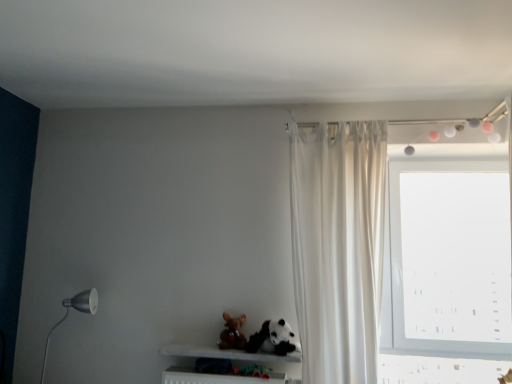
What is the approximate width of matte black lamp at left?

6.43 inches.

What is the approximate height of transparent glass window at upper right?

transparent glass window at upper right is 4.97 feet tall.

This screenshot has width=512, height=384. Describe the element at coordinates (447, 259) in the screenshot. I see `transparent glass window at upper right` at that location.

Measure the distance between black plush panda at lower center and camera.

The depth of black plush panda at lower center is 7.86 feet.

Describe the element at coordinates (232, 333) in the screenshot. I see `velvety brown teddy bear at lower center` at that location.

Where is `velvety brown teddy bear at lower center`? velvety brown teddy bear at lower center is located at coordinates (232, 333).

What do you see at coordinates (338, 247) in the screenshot?
I see `white silky curtain at right` at bounding box center [338, 247].

The image size is (512, 384). I want to click on white silky curtain at right, so click(x=338, y=247).

Locate an element on the screen. The height and width of the screenshot is (384, 512). matte black lamp at left is located at coordinates (68, 313).

Would you say white marble shelf at lower center is a long distance from white silky curtain at right?

That's not correct — white marble shelf at lower center is a little close to white silky curtain at right.

The width and height of the screenshot is (512, 384). I want to click on shelf that appears below the white silky curtain at right (from the image's perspective), so click(226, 353).

Can you tell me how much white marble shelf at lower center and white silky curtain at right differ in facing direction?

The angle between the facing direction of white marble shelf at lower center and the facing direction of white silky curtain at right is 4.26 degrees.

Which object is thinner, white marble shelf at lower center or white silky curtain at right?

With smaller width is white marble shelf at lower center.

Considering the sizes of white silky curtain at right and velvety brown teddy bear at lower center in the image, is white silky curtain at right wider or thinner than velvety brown teddy bear at lower center?

In the image, white silky curtain at right appears to be wider than velvety brown teddy bear at lower center.

From a real-world perspective, is white silky curtain at right positioned over velvety brown teddy bear at lower center based on gravity?

Indeed, from a real-world perspective, white silky curtain at right stands above velvety brown teddy bear at lower center.

Which of these two, white silky curtain at right or velvety brown teddy bear at lower center, stands shorter?

velvety brown teddy bear at lower center.

Is white silky curtain at right smaller than velvety brown teddy bear at lower center?

Actually, white silky curtain at right might be larger than velvety brown teddy bear at lower center.

Does white marble shelf at lower center come in front of transparent glass window at upper right?

That is True.

Can you confirm if white marble shelf at lower center is taller than transparent glass window at upper right?

No.

From a real-world perspective, is white marble shelf at lower center above or below transparent glass window at upper right?

white marble shelf at lower center is situated lower than transparent glass window at upper right in the real world.

Considering the relative positions of white marble shelf at lower center and velvety brown teddy bear at lower center in the image provided, is white marble shelf at lower center behind velvety brown teddy bear at lower center?

That is False.

Between point (214, 356) and point (229, 328), which one is positioned behind?

The point (229, 328) is farther from the camera.

Considering the relative sizes of white marble shelf at lower center and velvety brown teddy bear at lower center in the image provided, is white marble shelf at lower center smaller than velvety brown teddy bear at lower center?

No, white marble shelf at lower center is not smaller than velvety brown teddy bear at lower center.

Looking at this image, are white marble shelf at lower center and velvety brown teddy bear at lower center far apart?

They are positioned close to each other.

Which object is further away from the camera, transparent glass window at upper right or white marble shelf at lower center?

transparent glass window at upper right is further from the camera.

Can you confirm if transparent glass window at upper right is taller than white marble shelf at lower center?

Indeed, transparent glass window at upper right has a greater height compared to white marble shelf at lower center.

Is transparent glass window at upper right not within white marble shelf at lower center?

That's correct, transparent glass window at upper right is outside of white marble shelf at lower center.

From the image's perspective, who appears lower, transparent glass window at upper right or white marble shelf at lower center?

white marble shelf at lower center.

Which object is thinner, white silky curtain at right or matte black lamp at left?

With smaller width is matte black lamp at left.

What's the angular difference between white silky curtain at right and matte black lamp at left's facing directions?

There is a 6.66e-05-degree angle between the facing directions of white silky curtain at right and matte black lamp at left.

Would you consider white silky curtain at right to be distant from matte black lamp at left?

white silky curtain at right is positioned a significant distance from matte black lamp at left.

Is white silky curtain at right to the left of matte black lamp at left from the viewer's perspective?

No, white silky curtain at right is not to the left of matte black lamp at left.

Consider the image. Which object is closer to the camera taking this photo, black plush panda at lower center or white marble shelf at lower center?

black plush panda at lower center.

Is black plush panda at lower center not close to white marble shelf at lower center?

Actually, black plush panda at lower center and white marble shelf at lower center are a little close together.

At what (x,y) coordinates should I click in order to perform the action: click on animal above the white marble shelf at lower center (from the image's perspective). Please return your answer as a coordinate pair (x, y). The image size is (512, 384). Looking at the image, I should click on (273, 339).

Identify the location of shelf that is under the white silky curtain at right (from a real-world perspective). (226, 353).

Locate an element on the screen. Image resolution: width=512 pixels, height=384 pixels. curtain on the right of the velvety brown teddy bear at lower center is located at coordinates (338, 247).

When comparing their distances from transparent glass window at upper right, does matte black lamp at left or white silky curtain at right seem closer?

Among the two, white silky curtain at right is located nearer to transparent glass window at upper right.

From the image, which object appears to be nearer to velvety brown teddy bear at lower center, matte black lamp at left or transparent glass window at upper right?

matte black lamp at left is positioned closer to the anchor velvety brown teddy bear at lower center.

Considering their positions, is white silky curtain at right positioned further to black plush panda at lower center than velvety brown teddy bear at lower center?

white silky curtain at right.

Which object lies further to the anchor point black plush panda at lower center, velvety brown teddy bear at lower center or white marble shelf at lower center?

The object further to black plush panda at lower center is velvety brown teddy bear at lower center.

Based on their spatial positions, is velvety brown teddy bear at lower center or matte black lamp at left closer to white silky curtain at right?

velvety brown teddy bear at lower center lies closer to white silky curtain at right than the other object.

Looking at this image, which object lies nearer to the anchor point white marble shelf at lower center, transparent glass window at upper right or matte black lamp at left?

matte black lamp at left is positioned closer to the anchor white marble shelf at lower center.

Based on their spatial positions, is matte black lamp at left or transparent glass window at upper right further from black plush panda at lower center?

transparent glass window at upper right lies further to black plush panda at lower center than the other object.

Based on their spatial positions, is black plush panda at lower center or transparent glass window at upper right closer to white marble shelf at lower center?

The object closer to white marble shelf at lower center is black plush panda at lower center.

I want to click on toy located between matte black lamp at left and white silky curtain at right in the left-right direction, so click(232, 333).

I want to click on toy between white marble shelf at lower center and black plush panda at lower center from left to right, so click(232, 333).

At what (x,y) coordinates should I click in order to perform the action: click on curtain situated between velvety brown teddy bear at lower center and transparent glass window at upper right from left to right. Please return your answer as a coordinate pair (x, y). The width and height of the screenshot is (512, 384). Looking at the image, I should click on (338, 247).

Locate an element on the screen. Image resolution: width=512 pixels, height=384 pixels. toy between white marble shelf at lower center and transparent glass window at upper right is located at coordinates (232, 333).